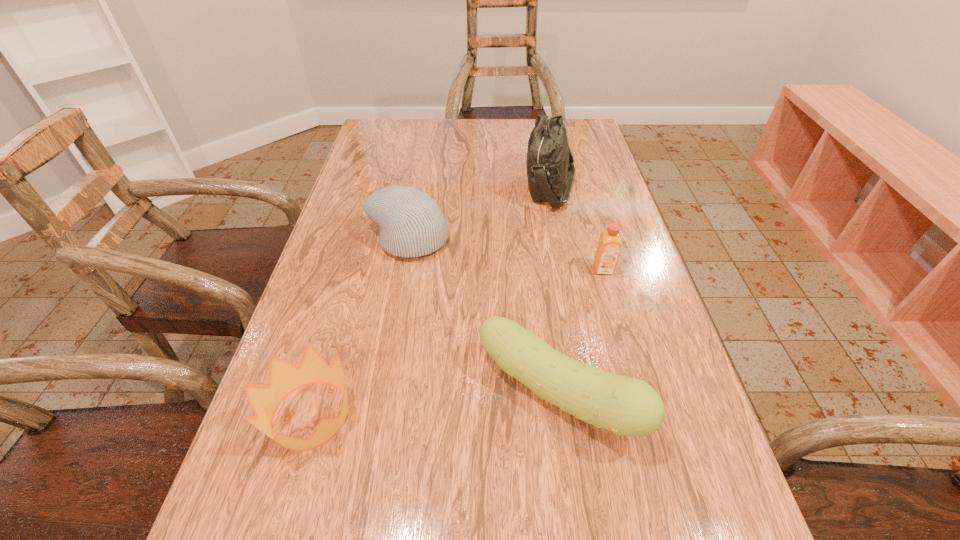
Locate an element on the screen. vacant area between the tallest object and the beanie is located at coordinates (479, 213).

The width and height of the screenshot is (960, 540). Find the location of `free space that is in between the orange juice and the shortest object`. free space that is in between the orange juice and the shortest object is located at coordinates (457, 342).

Find the location of `vacant area that lies between the orange juice and the farthest object`. vacant area that lies between the orange juice and the farthest object is located at coordinates click(x=577, y=227).

Locate an element on the screen. The width and height of the screenshot is (960, 540). object that is the closest to the crown is located at coordinates (626, 406).

Identify which object is located as the second nearest to the beanie. Please provide its 2D coordinates. Your answer should be formatted as a tuple, i.e. [(x, y)], where the tuple contains the x and y coordinates of a point satisfying the conditions above.

[(626, 406)]

The height and width of the screenshot is (540, 960). In order to click on free space that satisfies the following two spatial constraints: 1. on the front side of the beanie; 2. on the right side of the cucumber in this screenshot , I will do `click(379, 395)`.